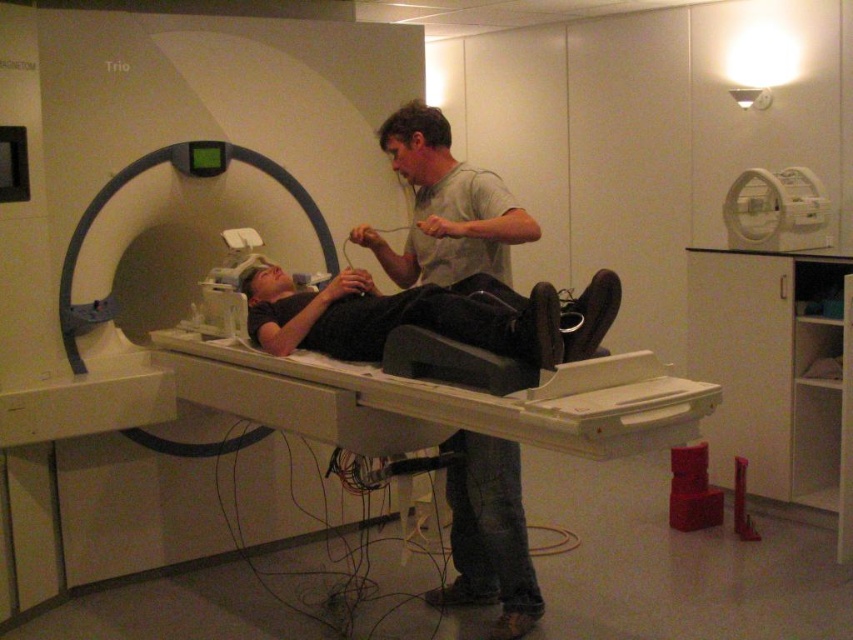
You are a patient preparing for an MRI scan. You see the matte black mri bed at center and the white plastic scanner at upper right. Where should you lie down to be properly positioned under the scanner?

You should lie down on the matte black mri bed at center because it is positioned under the white plastic scanner at upper right, ensuring proper alignment for the scan.

You are a medical technician who needs to move a medical device from the white plastic scanner at upper right to the matte black mri bed at center. The device must be placed exactly between them. Is there enough space to do this without moving either object?

The distance between the matte black mri bed at center and the white plastic scanner at upper right is 2.10 meters. Since the device needs to be placed exactly between them, there is sufficient space as the midpoint would be at 1.05 meters from each object, allowing placement without moving either.

You are a technician standing at the camera position in the MRI room. You need to reach the point labeled as point [378,312] to adjust a cable. Considering the MRI machine is between you and the point, can you safely walk around the MRI machine to reach it without getting too close to the machine itself?

The distance between the point [378,312] and the camera is 7.87 feet. Since the MRI machine is between you and the point, you can safely walk around it while maintaining a safe distance from the machine itself to reach the point.